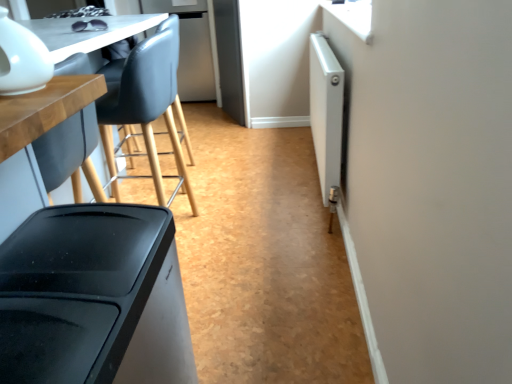
What are the coordinates of `free space on the front side of white metallic radiator at right, which is the first appliance in right-to-left order` in the screenshot? It's located at (282, 246).